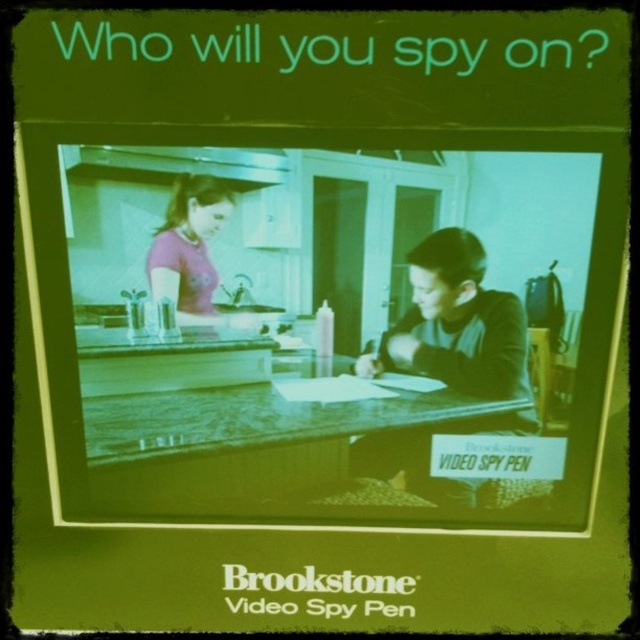
Question: Among these objects, which one is farthest from the camera?

Choices:
 (A) matte purple shirt at upper left
 (B) matte plastic counter top at center

Answer: (B)

Question: Does matte black shirt at center lie in front of matte purple shirt at upper left?

Choices:
 (A) no
 (B) yes

Answer: (A)

Question: Which of the following is the closest to the observer?

Choices:
 (A) (275, 388)
 (B) (176, 236)
 (C) (428, 356)

Answer: (B)

Question: Considering the relative positions of matte plastic counter top at center and matte black shirt at center in the image provided, where is matte plastic counter top at center located with respect to matte black shirt at center?

Choices:
 (A) above
 (B) below

Answer: (B)

Question: Which object is positioned farthest from the matte plastic counter top at center?

Choices:
 (A) matte black shirt at center
 (B) matte purple shirt at upper left

Answer: (B)

Question: Considering the relative positions of matte black shirt at center and matte purple shirt at upper left in the image provided, where is matte black shirt at center located with respect to matte purple shirt at upper left?

Choices:
 (A) below
 (B) above

Answer: (A)